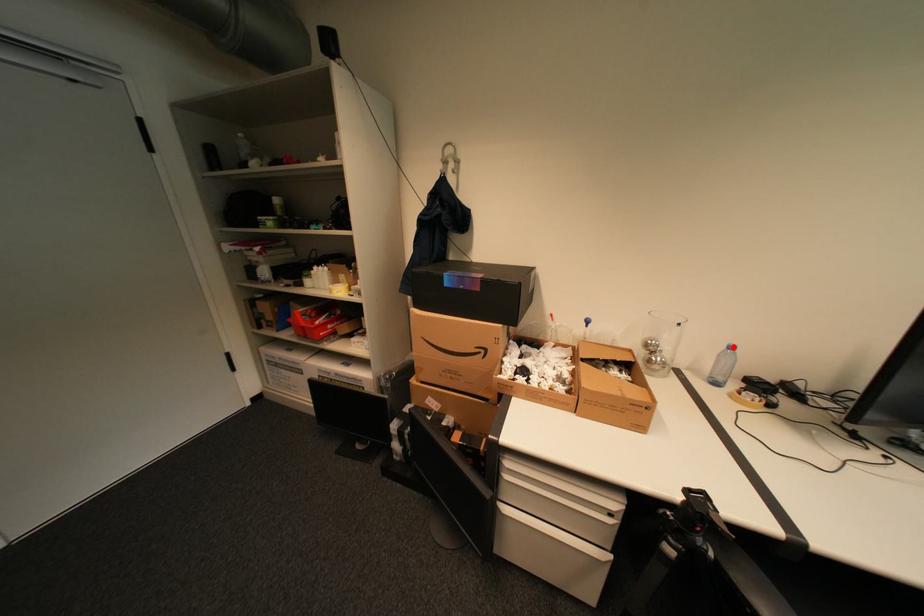
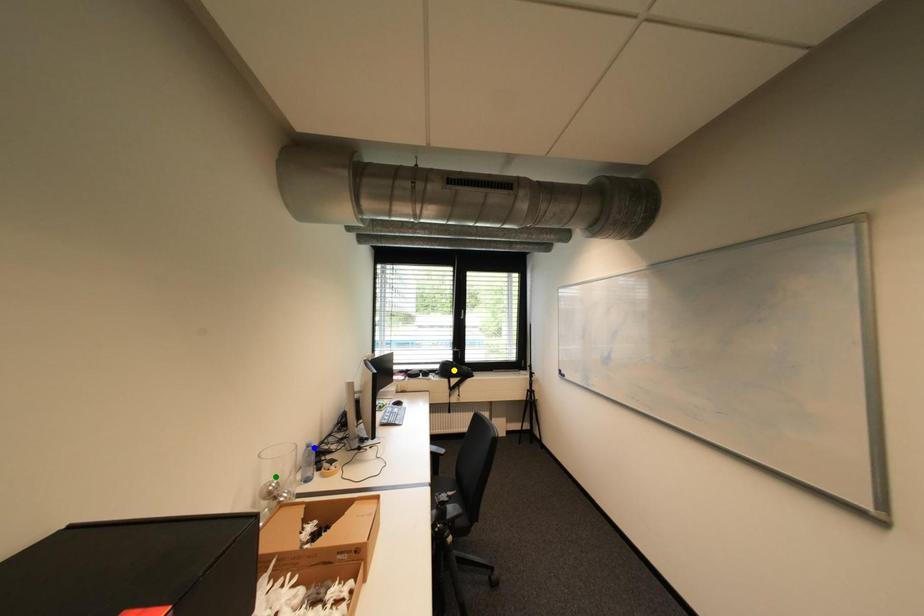
Question: I am providing you with two images of the same scene from different viewpoints. A red point is marked on the first image. You are given multiple points on the second image. Can you choose the point in image 2 that corresponds to the point in image 1?

Choices:
 (A) yellow point
 (B) green point
 (C) blue point

Answer: (C)